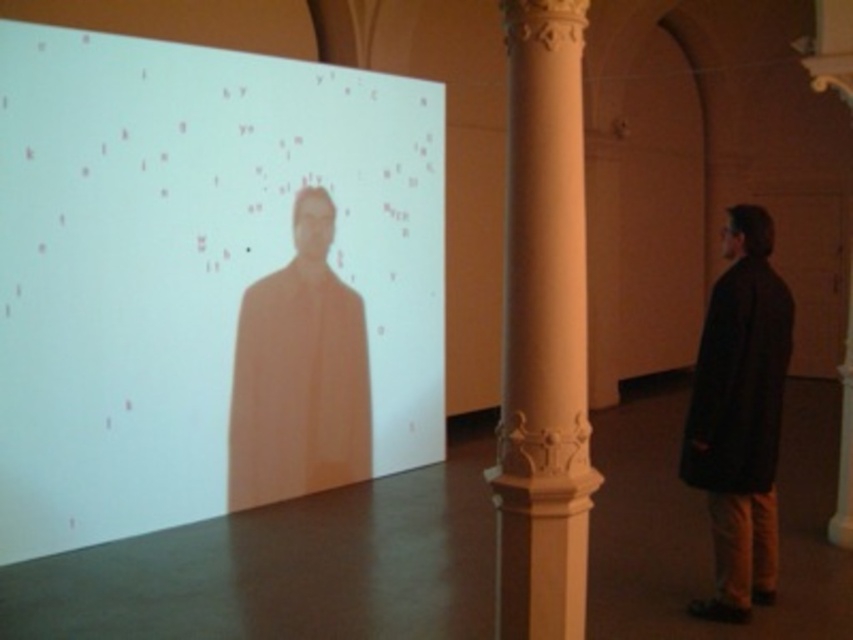
Is white matte projection screen at upper left wider than dark matte coat at right?

Yes.

Does point (57, 54) come closer to viewer compared to point (747, 596)?

No, (57, 54) is further to viewer.

Is point (79, 372) positioned after point (734, 412)?

Yes.

In order to click on white matte projection screen at upper left in this screenshot , I will do pyautogui.click(x=202, y=278).

Does matte orange coat at center appear over white marble pillar at center?

Indeed, matte orange coat at center is positioned over white marble pillar at center.

Who is more forward, (292,209) or (840,500)?

Positioned in front is point (840,500).

Where is `matte orange coat at center`? This screenshot has height=640, width=853. matte orange coat at center is located at coordinates (299, 372).

Can you confirm if white matte projection screen at upper left is taller than white marble column at center?

Yes, white matte projection screen at upper left is taller than white marble column at center.

Does point (6, 253) come behind point (579, 426)?

Yes.

Who is more forward, (380, 410) or (577, 84)?

Point (577, 84) is more forward.

Locate an element on the screen. white matte projection screen at upper left is located at coordinates (202, 278).